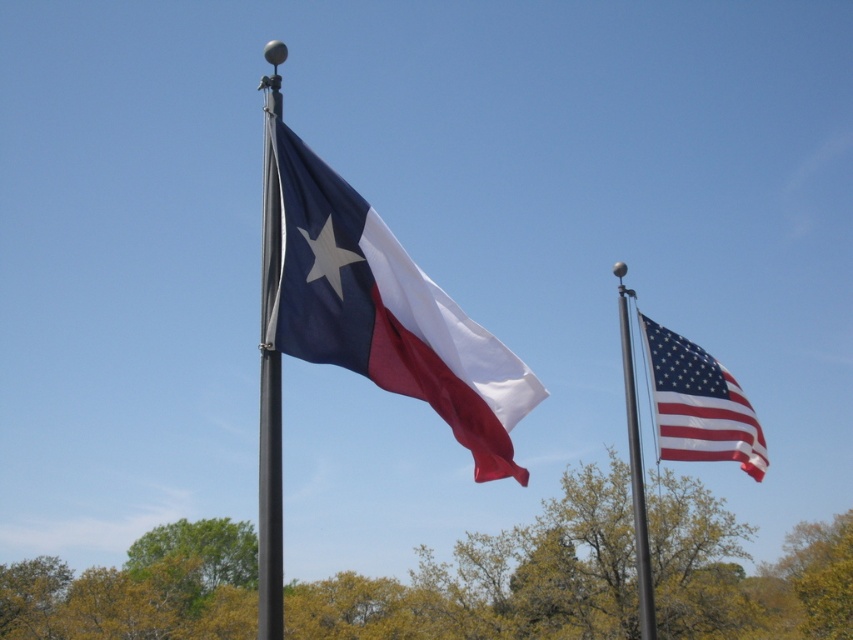
You are a photographer planning to capture both the matte polyester flag at center and the metallic pole at right in a single shot. Based on their positions, which object should you ensure is in the foreground to include both clearly?

The metallic pole at right should be in the foreground because the matte polyester flag at center is above it, so positioning the pole closer to the camera allows both to be in frame without one blocking the other.

You are a flag installer checking the height of the flags. According to the scene, which flag is taller, the matte polyester flag at center or the american flag at right?

The matte polyester flag at center is taller than the american flag at right.

You are standing in front of the two flagpoles. The Texas state flag and the American flag are both flying. There is a specific point marked at coordinates (x=386, y=312). Which flag is closer to this point?

The matte polyester flag at center is located at point (x=386, y=312), so the flag at that point is the matte polyester flag at center.